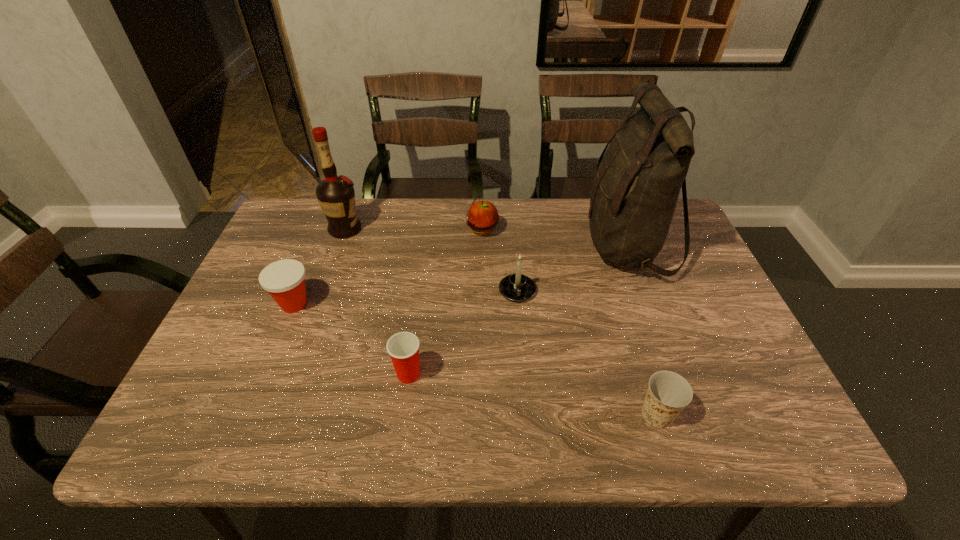
What are the coordinates of `vacant region located 0.350m on the open flap of the backpack` in the screenshot? It's located at (463, 245).

The width and height of the screenshot is (960, 540). What are the coordinates of `vacant space located 0.320m on the open flap of the backpack` in the screenshot? It's located at (473, 245).

Where is `vacant space situated 0.320m on the front and back of the liquor`? vacant space situated 0.320m on the front and back of the liquor is located at coordinates (468, 230).

At what (x,y) coordinates should I click in order to perform the action: click on vacant space located 0.180m with a handle on the side of the candle holder. Please return your answer as a coordinate pair (x, y). The image size is (960, 540). Looking at the image, I should click on (523, 364).

Where is `free region located 0.220m on the left of the apple`? free region located 0.220m on the left of the apple is located at coordinates (394, 230).

What are the coordinates of `free space located on the back of the leftmost Dixie cup` in the screenshot? It's located at (321, 239).

This screenshot has height=540, width=960. Identify the location of vacant space located 0.110m on the left of the sixth farthest object. (343, 374).

The width and height of the screenshot is (960, 540). Identify the location of blank space located 0.290m on the left of the nearest Dixie cup. (494, 414).

At what (x,y) coordinates should I click in order to perform the action: click on backpack at the far edge. Please return your answer as a coordinate pair (x, y). This screenshot has width=960, height=540. Looking at the image, I should click on (635, 191).

Locate an element on the screen. Image resolution: width=960 pixels, height=540 pixels. liquor that is at the far edge is located at coordinates click(336, 196).